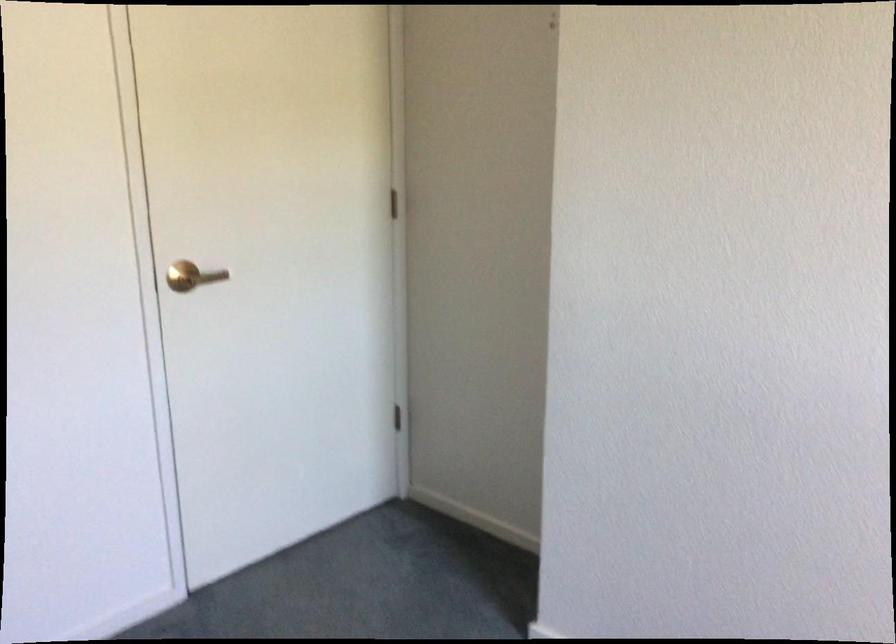
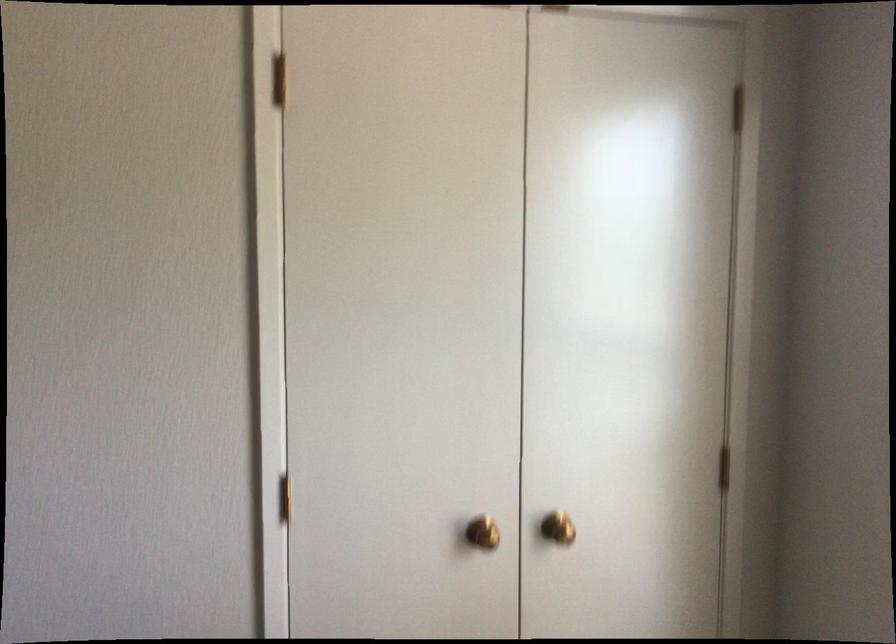
Question: The camera is either moving clockwise (left) or counter-clockwise (right) around the object. The first image is from the beginning of the video and the second image is from the end. Is the camera moving left or right when shooting the video?

Choices:
 (A) Left
 (B) Right

Answer: (A)